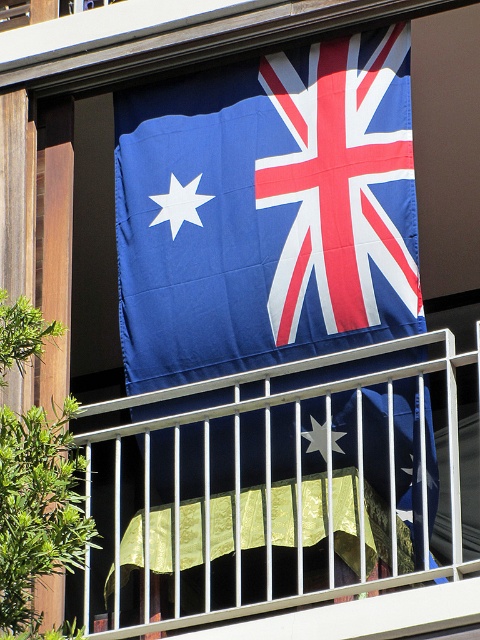
You are a painter who needs to hang a new flag on the balcony. The flag you have is 2 meters wide. The existing blue fabric flag at upper center is currently hanging from the metallic silver balustrade at upper center. Can you place your new flag next to the existing one without overlapping?

The blue fabric flag at upper center and metallic silver balustrade at upper center are 2.34 meters apart. Since your new flag is 2 meters wide and there is 2.34 meters of space available, you can place your new flag next to the existing one without overlapping as there is sufficient space.

You are standing on the balcony and want to hang a new flag between the two points, point (365, 65) and point (272, 573). Which point should you attach the top of the flag to ensure it hangs properly?

You should attach the top of the flag to point (365, 65) because it is further to the camera than point (272, 573), ensuring the flag hangs properly.

You are standing on the balcony looking at the blue fabric flag at upper center and the metallic silver balustrade at upper center. Which object is closer to the left side of the balcony?

The blue fabric flag at upper center is closer to the left side of the balcony because it is positioned to the left of the metallic silver balustrade at upper center.